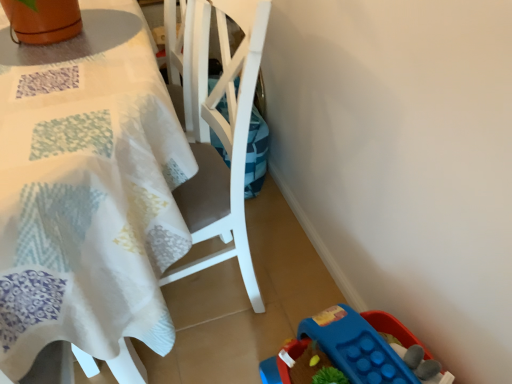
Question: Considering the relative sizes of white plastic chair at center and blue plastic toy at lower right in the image provided, is white plastic chair at center thinner than blue plastic toy at lower right?

Choices:
 (A) no
 (B) yes

Answer: (A)

Question: From a real-world perspective, is white plastic chair at center positioned over blue plastic toy at lower right based on gravity?

Choices:
 (A) no
 (B) yes

Answer: (B)

Question: From a real-world perspective, is white plastic chair at center located beneath blue plastic toy at lower right?

Choices:
 (A) yes
 (B) no

Answer: (B)

Question: From the image's perspective, is white plastic chair at center above blue plastic toy at lower right?

Choices:
 (A) yes
 (B) no

Answer: (A)

Question: Considering the relative sizes of white plastic chair at center and blue plastic toy at lower right in the image provided, is white plastic chair at center wider than blue plastic toy at lower right?

Choices:
 (A) yes
 (B) no

Answer: (A)

Question: Could you tell me if white plastic chair at center is facing blue plastic toy at lower right?

Choices:
 (A) no
 (B) yes

Answer: (A)

Question: Is blue plastic toy at lower right next to white plastic chair at center?

Choices:
 (A) no
 (B) yes

Answer: (A)

Question: From the image's perspective, would you say blue plastic toy at lower right is shown under white plastic chair at center?

Choices:
 (A) yes
 (B) no

Answer: (A)

Question: Is the depth of blue plastic toy at lower right greater than that of white plastic chair at center?

Choices:
 (A) no
 (B) yes

Answer: (B)

Question: Is the position of blue plastic toy at lower right less distant than that of white plastic chair at center?

Choices:
 (A) yes
 (B) no

Answer: (B)

Question: Would you say blue plastic toy at lower right is outside white plastic chair at center?

Choices:
 (A) no
 (B) yes

Answer: (B)

Question: Can you confirm if blue plastic toy at lower right is bigger than white plastic chair at center?

Choices:
 (A) no
 (B) yes

Answer: (A)

Question: Is white fabric table at upper left to the right of blue plastic toy at lower right from the viewer's perspective?

Choices:
 (A) no
 (B) yes

Answer: (A)